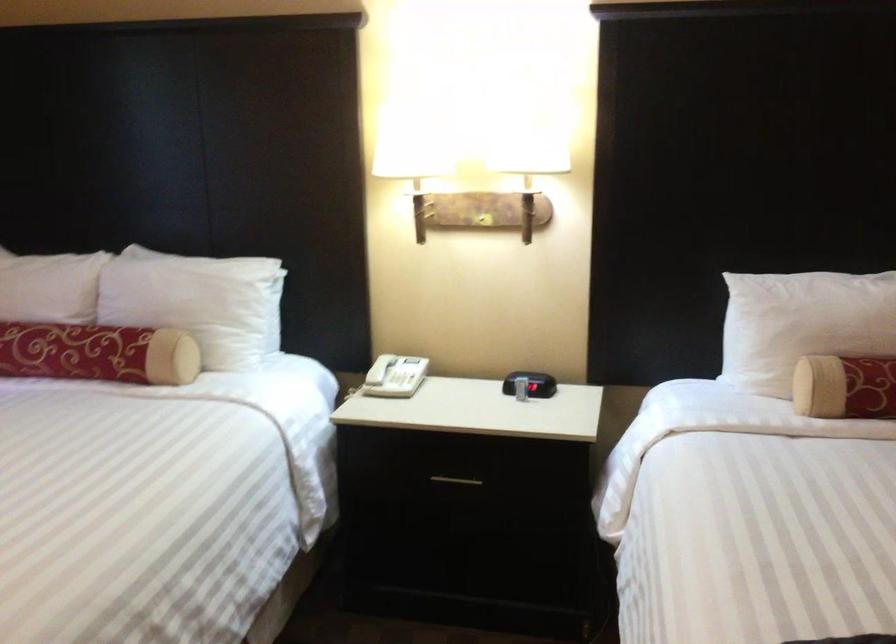
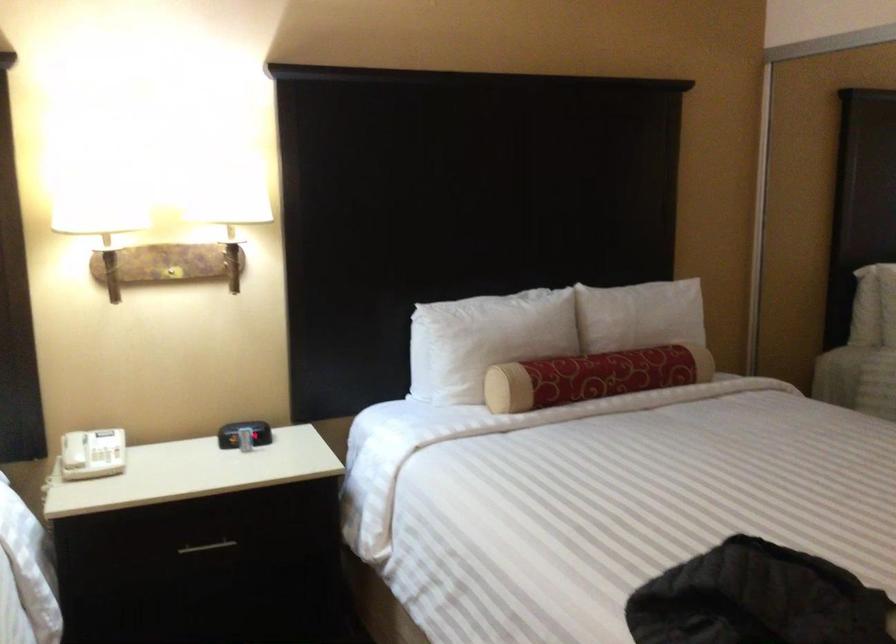
The point at (375,368) is marked in the first image. Where is the corresponding point in the second image?

(73, 450)